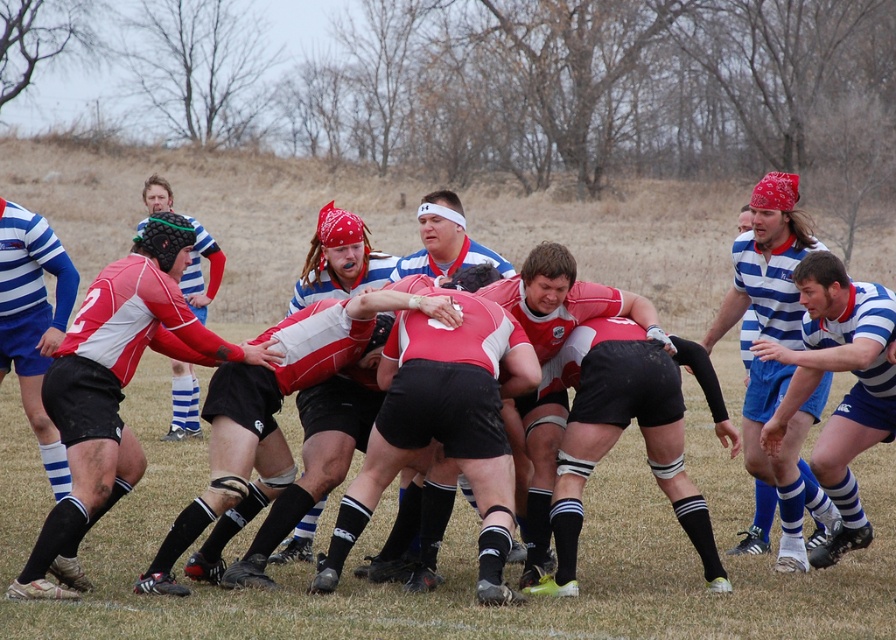
Which is more to the right, blue striped jersey at center or matte red jersey at center?

blue striped jersey at center

Can you confirm if blue striped jersey at center is positioned below matte red jersey at center?

Yes, blue striped jersey at center is below matte red jersey at center.

Who is more distant from viewer, (776, 211) or (188, 404)?

Positioned behind is point (188, 404).

At what (x,y) coordinates should I click in order to perform the action: click on blue striped jersey at center. Please return your answer as a coordinate pair (x, y). This screenshot has width=896, height=640. Looking at the image, I should click on (767, 264).

Between point (866, 310) and point (194, 285), which one is positioned in front?

Point (866, 310) is more forward.

Between point (784, 429) and point (199, 230), which one is positioned behind?

Positioned behind is point (199, 230).

Where is `blue striped jersey at right`? This screenshot has width=896, height=640. blue striped jersey at right is located at coordinates (846, 394).

Looking at this image, can you confirm if blue striped jersey at right is positioned above blue striped jersey at center?

No, blue striped jersey at right is not above blue striped jersey at center.

Based on the photo, how distant is blue striped jersey at right from blue striped jersey at center?

blue striped jersey at right and blue striped jersey at center are 11.47 inches apart from each other.

Between point (845, 397) and point (784, 520), which one is positioned in front?

Point (845, 397) is in front.

Where is `blue striped jersey at right`? blue striped jersey at right is located at coordinates (846, 394).